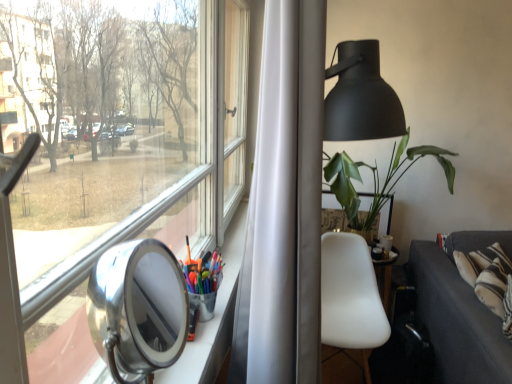
Question: Is polished silver view mirror at lower left to the right of dark gray fabric couch at lower right from the viewer's perspective?

Choices:
 (A) yes
 (B) no

Answer: (B)

Question: Is dark gray fabric couch at lower right completely or partially inside polished silver view mirror at lower left?

Choices:
 (A) yes
 (B) no

Answer: (B)

Question: Can you see polished silver view mirror at lower left touching dark gray fabric couch at lower right?

Choices:
 (A) no
 (B) yes

Answer: (A)

Question: Are polished silver view mirror at lower left and dark gray fabric couch at lower right located far from each other?

Choices:
 (A) no
 (B) yes

Answer: (B)

Question: Could you tell me if polished silver view mirror at lower left is turned towards dark gray fabric couch at lower right?

Choices:
 (A) no
 (B) yes

Answer: (A)

Question: Considering the positions of point (354, 206) and point (362, 324), is point (354, 206) closer or farther from the camera than point (362, 324)?

Choices:
 (A) closer
 (B) farther

Answer: (B)

Question: In terms of height, does green matte plant at right look taller or shorter compared to white matte chair at center-right?

Choices:
 (A) short
 (B) tall

Answer: (A)

Question: Is green matte plant at right wider or thinner than white matte chair at center-right?

Choices:
 (A) thin
 (B) wide

Answer: (B)

Question: In the image, is green matte plant at right positioned in front of or behind white matte chair at center-right?

Choices:
 (A) behind
 (B) front

Answer: (A)

Question: Based on their positions, is white matte chair at center-right located to the left or right of polished silver view mirror at lower left?

Choices:
 (A) left
 (B) right

Answer: (B)

Question: From the image's perspective, relative to polished silver view mirror at lower left, is white matte chair at center-right above or below?

Choices:
 (A) below
 (B) above

Answer: (A)

Question: Is white matte chair at center-right wider or thinner than polished silver view mirror at lower left?

Choices:
 (A) thin
 (B) wide

Answer: (B)

Question: Is white matte chair at center-right in front of or behind polished silver view mirror at lower left in the image?

Choices:
 (A) behind
 (B) front

Answer: (A)

Question: Is dark gray fabric couch at lower right to the left or to the right of white matte chair at center-right in the image?

Choices:
 (A) left
 (B) right

Answer: (B)

Question: Do you think dark gray fabric couch at lower right is within white matte chair at center-right, or outside of it?

Choices:
 (A) outside
 (B) inside

Answer: (A)